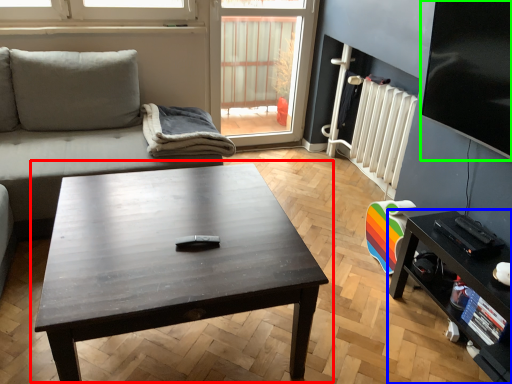
Question: Which object is positioned closest to coffee table (highlighted by a red box)? Select from table (highlighted by a blue box) and window screen (highlighted by a green box).

Choices:
 (A) table
 (B) window screen

Answer: (A)